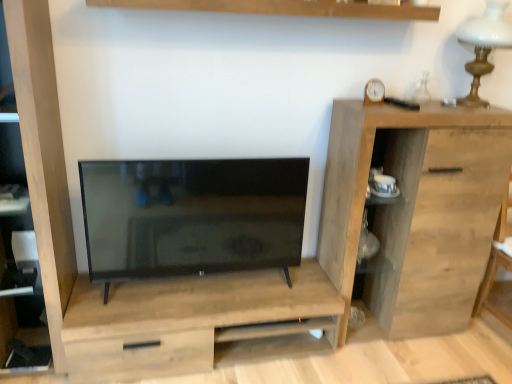
The height and width of the screenshot is (384, 512). Identify the location of vacant area situated below matte black tv at center (from a real-world perspective). (207, 287).